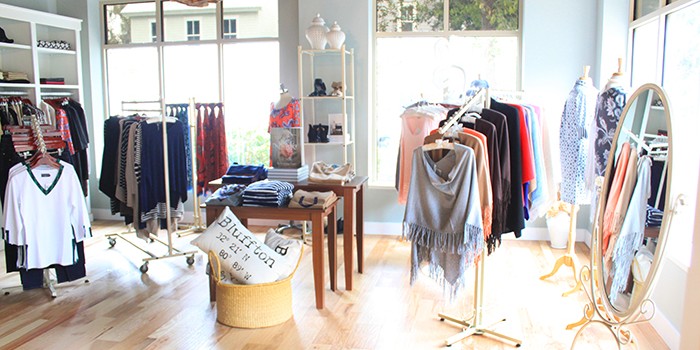
I want to click on window frosters, so click(x=141, y=81), click(x=180, y=80), click(x=237, y=75), click(x=390, y=65), click(x=468, y=60), click(x=650, y=47), click(x=679, y=51).